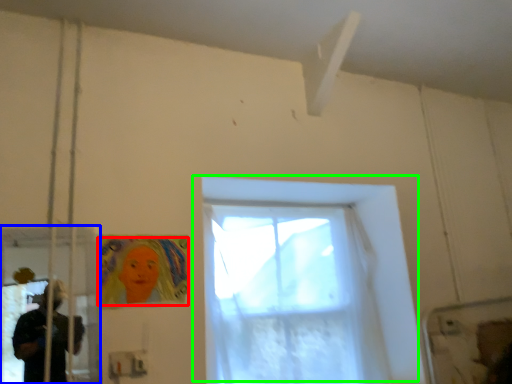
Question: Based on their relative distances, which object is farther from woman (highlighted by a red box)? Choose from screen door (highlighted by a blue box) and window (highlighted by a green box).

Choices:
 (A) screen door
 (B) window

Answer: (B)